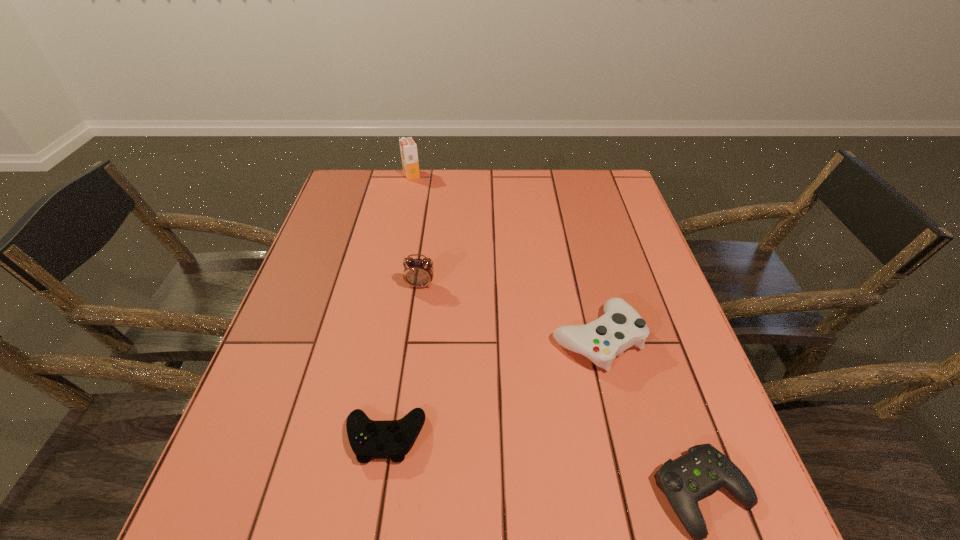
You are a GUI agent. You are given a task and a screenshot of the screen. Output one action in this format:
    pyautogui.click(x=<x>, y=<y>)
    Task: Click on the free spot that satisfies the following two spatial constraints: 1. on the face of the alarm clock; 2. on the right side of the third farthest object
    This screenshot has width=960, height=540.
    Given the screenshot: What is the action you would take?
    pyautogui.click(x=413, y=338)